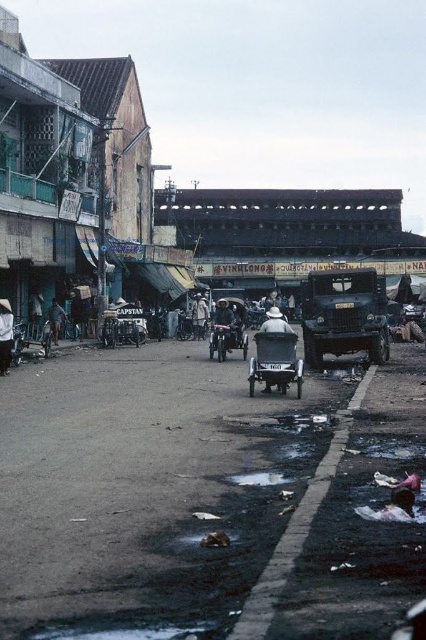
You are standing on the street and see both the dark blue fabric umbrella at center and the light brown fabric hat at center. Which object is positioned to the right from your perspective?

The dark blue fabric umbrella at center is positioned to the right of the light brown fabric hat at center.

You are a pedestrian standing on the street and see both the dark blue fabric umbrella at center and the white fabric hat at center. Which object is taller?

The dark blue fabric umbrella at center is taller than the white fabric hat at center.

Based on the photo, you are a pedestrian standing on the street and see the dark blue fabric umbrella at center and the white fabric hat at center. Which object is positioned higher?

The dark blue fabric umbrella at center is above the white fabric hat at center, so it is positioned higher.